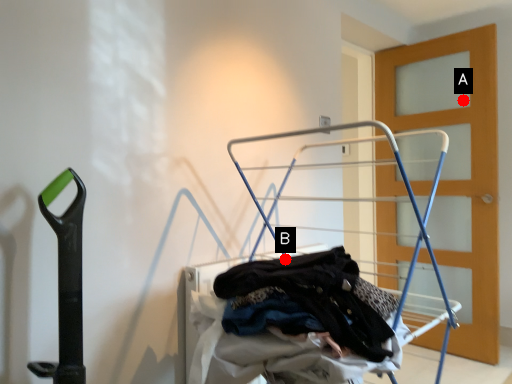
Question: Two points are circled on the image, labeled by A and B beside each circle. Which point is closer to the camera?

Choices:
 (A) A is closer
 (B) B is closer

Answer: (B)